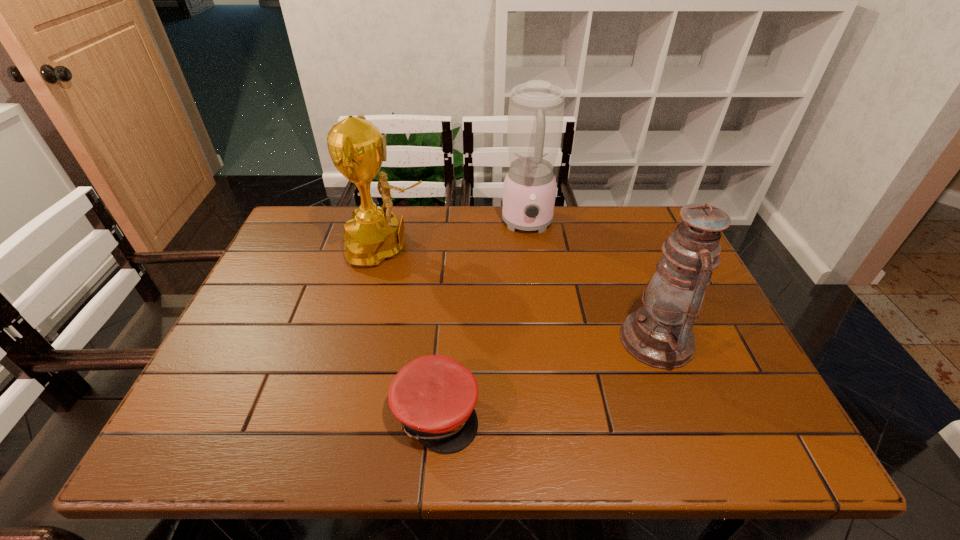
Locate an element on the screen. object at the near edge is located at coordinates (434, 396).

Find the location of a particular element. The image size is (960, 540). object located at the right edge is located at coordinates (659, 334).

The height and width of the screenshot is (540, 960). I want to click on vacant region at the far edge, so click(477, 217).

Image resolution: width=960 pixels, height=540 pixels. Find the location of `vacant space at the near edge`. vacant space at the near edge is located at coordinates (679, 445).

In the image, there is a desktop. Identify the location of vacant space at the right edge. (748, 381).

In the image, there is a desktop. Where is `vacant region at the far left corner`? The image size is (960, 540). vacant region at the far left corner is located at coordinates (325, 206).

At what (x,y) coordinates should I click in order to perform the action: click on vacant space at the near left corner. Please return your answer as a coordinate pair (x, y). The width and height of the screenshot is (960, 540). Looking at the image, I should click on (261, 427).

The image size is (960, 540). Find the location of `vacant space at the far right corner of the desktop`. vacant space at the far right corner of the desktop is located at coordinates (615, 214).

In order to click on free space between the shortest object and the second object from right to left in this screenshot , I will do `click(482, 318)`.

You are a GUI agent. You are given a task and a screenshot of the screen. Output one action in this format:
    pyautogui.click(x=<x>, y=<y>)
    Task: Click on the vacant space in between the shortest object and the third object from left to right
    
    Given the screenshot: What is the action you would take?
    pyautogui.click(x=482, y=318)